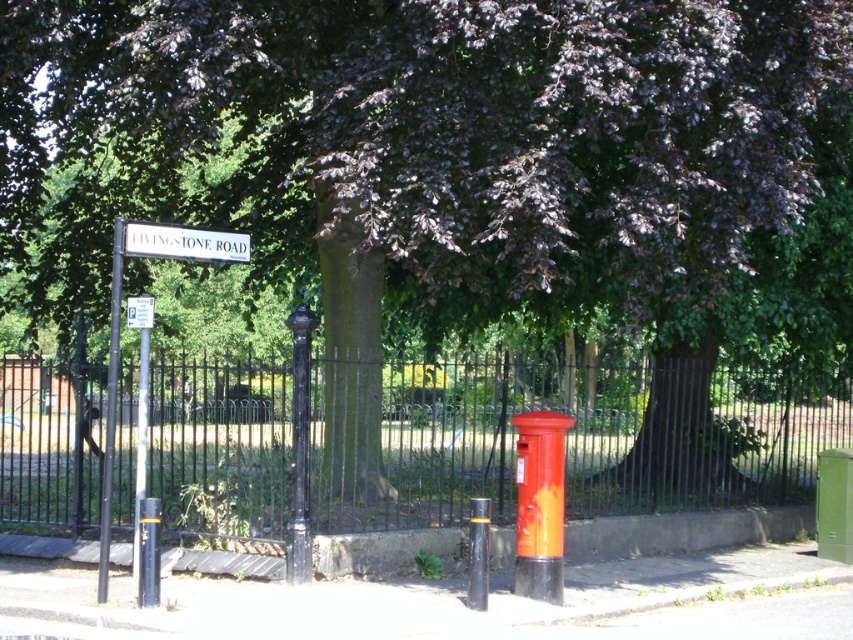
Question: Does black polished metal pole at center come in front of black metal pole at left?

Choices:
 (A) no
 (B) yes

Answer: (A)

Question: Which object is the farthest from the brushed metal signpost at left?

Choices:
 (A) black polished metal pole at center
 (B) white plastic parking sign at upper left
 (C) black metal pole at left
 (D) black metal fence at center

Answer: (D)

Question: Does white plastic sign at upper center appear on the left side of black metal pole at left?

Choices:
 (A) no
 (B) yes

Answer: (A)

Question: Which object appears closest to the camera in this image?

Choices:
 (A) white plastic parking sign at upper left
 (B) brushed metal signpost at left
 (C) black metal fence at center

Answer: (B)

Question: Estimate the real-world distances between objects in this image. Which object is closer to the brushed metal signpost at left?

Choices:
 (A) white plastic street sign at upper left
 (B) black polished metal pole at center
 (C) white plastic parking sign at upper left

Answer: (A)

Question: Is black metal pole at left below white plastic parking sign at upper left?

Choices:
 (A) no
 (B) yes

Answer: (B)